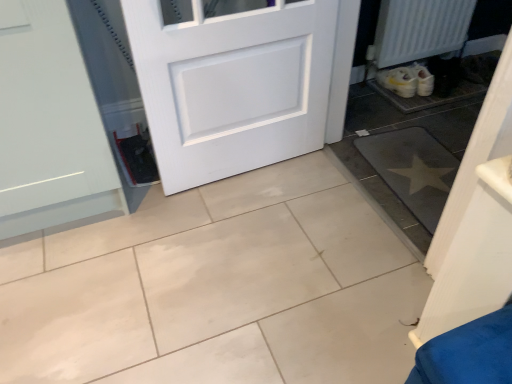
Question: Which direction should I rotate to face white glossy tile at center, acting as the first ceramic tile starting from the left, — up or down?

Choices:
 (A) down
 (B) up

Answer: (A)

Question: Considering the relative positions of white textured radiator at lower right and white glossy tile at center, which is the second ceramic tile from right to left, in the image provided, is white textured radiator at lower right to the right of white glossy tile at center, which is the second ceramic tile from right to left, from the viewer's perspective?

Choices:
 (A) yes
 (B) no

Answer: (A)

Question: Can you confirm if white textured radiator at lower right is positioned to the left of white glossy tile at center, which is the second ceramic tile from right to left?

Choices:
 (A) no
 (B) yes

Answer: (A)

Question: Does white textured radiator at lower right have a smaller size compared to white glossy tile at center, which is the second ceramic tile from right to left?

Choices:
 (A) no
 (B) yes

Answer: (B)

Question: Is white textured radiator at lower right shorter than white glossy tile at center, acting as the first ceramic tile starting from the left?

Choices:
 (A) no
 (B) yes

Answer: (A)

Question: Can you confirm if white textured radiator at lower right is thinner than white glossy tile at center, acting as the first ceramic tile starting from the left?

Choices:
 (A) no
 (B) yes

Answer: (B)

Question: Considering the relative sizes of white textured radiator at lower right and white glossy tile at center, which is the second ceramic tile from right to left, in the image provided, is white textured radiator at lower right taller than white glossy tile at center, which is the second ceramic tile from right to left,?

Choices:
 (A) yes
 (B) no

Answer: (A)

Question: Considering the relative sizes of white glossy tile at center, which is the second ceramic tile from right to left, and gray matte mat at lower right, marked as the 2th ceramic tile in a left-to-right arrangement, in the image provided, is white glossy tile at center, which is the second ceramic tile from right to left, smaller than gray matte mat at lower right, marked as the 2th ceramic tile in a left-to-right arrangement,?

Choices:
 (A) yes
 (B) no

Answer: (B)

Question: Is the depth of white glossy tile at center, acting as the first ceramic tile starting from the left, greater than that of gray matte mat at lower right, marked as the 2th ceramic tile in a left-to-right arrangement?

Choices:
 (A) yes
 (B) no

Answer: (B)

Question: Is white glossy tile at center, which is the second ceramic tile from right to left, outside gray matte mat at lower right, marked as the 2th ceramic tile in a left-to-right arrangement?

Choices:
 (A) no
 (B) yes

Answer: (B)

Question: From the image's perspective, is white glossy tile at center, which is the second ceramic tile from right to left, located beneath gray matte mat at lower right, marked as the 1th ceramic tile in a right-to-left arrangement?

Choices:
 (A) yes
 (B) no

Answer: (A)

Question: Considering the relative sizes of white glossy tile at center, acting as the first ceramic tile starting from the left, and gray matte mat at lower right, marked as the 2th ceramic tile in a left-to-right arrangement, in the image provided, is white glossy tile at center, acting as the first ceramic tile starting from the left, wider than gray matte mat at lower right, marked as the 2th ceramic tile in a left-to-right arrangement,?

Choices:
 (A) no
 (B) yes

Answer: (B)

Question: Is the surface of white glossy tile at center, acting as the first ceramic tile starting from the left, in direct contact with gray matte mat at lower right, marked as the 1th ceramic tile in a right-to-left arrangement?

Choices:
 (A) no
 (B) yes

Answer: (A)

Question: Can you confirm if gray matte mat at lower right, marked as the 1th ceramic tile in a right-to-left arrangement, is bigger than white glossy tile at center, acting as the first ceramic tile starting from the left?

Choices:
 (A) yes
 (B) no

Answer: (B)